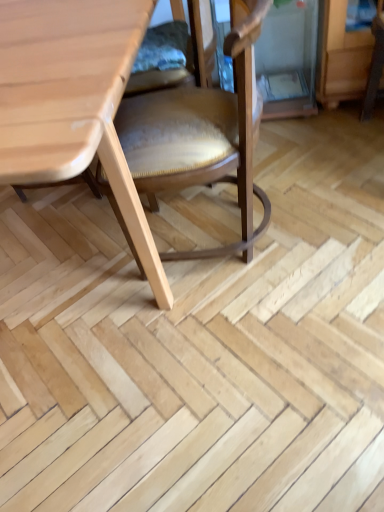
The width and height of the screenshot is (384, 512). Describe the element at coordinates (202, 126) in the screenshot. I see `wooden chair at center` at that location.

In order to face wooden chair at center, should I rotate leftwards or rightwards?

A 0.053 degree turn to the right will do.

Identify the location of wooden chair at center. (202, 126).

You are a GUI agent. You are given a task and a screenshot of the screen. Output one action in this format:
    pyautogui.click(x=<x>, y=<y>)
    Task: Click on the wooden chair at center
    The height and width of the screenshot is (512, 384).
    Given the screenshot: What is the action you would take?
    pyautogui.click(x=202, y=126)